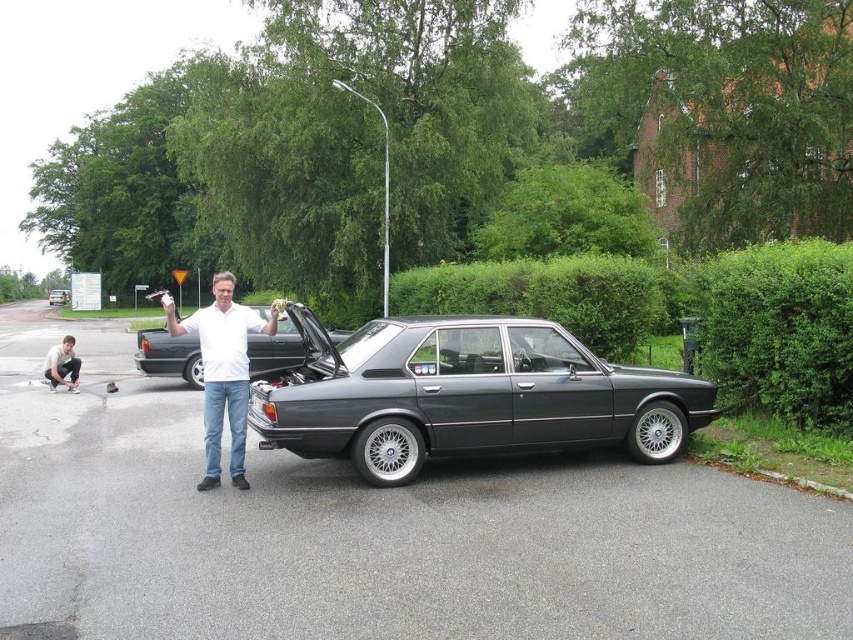
You are standing at the origin point in the scene. The metallic gray sedan at center is at coordinates 0.619, 0.549. If you want to walk directly to the sedan, which direction should you head?

The metallic gray sedan at center is located at coordinates (467, 396), so you should head towards the direction of the point with those coordinates to reach it.

You are a photographer standing at the position of the white matte shirt at center. You want to take a photo of the metallic gray sedan at center without any obstruction. Since you can only move forward or backward along the path, what is the minimum distance you need to move to ensure the sedan is fully visible in the frame?

The metallic gray sedan at center is currently 9.59 feet away from the white matte shirt at center. To ensure the sedan is fully visible without obstruction, you need to move forward or backward until the distance is adjusted appropriately. However, without knowing the camera lens specifications or the required framing, it is impossible to determine the exact minimum distance to move. Please provide more details about the camera equipment and desired framing.

You are a pedestrian standing at the edge of the road where the metallic gray sedan at center and metallic silver sedan at center are parked. You want to cross the road safely. Considering the distance between the two cars, can you safely cross the road without needing to walk between them?

The distance between the metallic gray sedan at center and metallic silver sedan at center is 98.33 meters. This large gap provides ample space for a pedestrian to cross safely between them without needing to walk through the entire distance, so yes, you can cross safely between them.